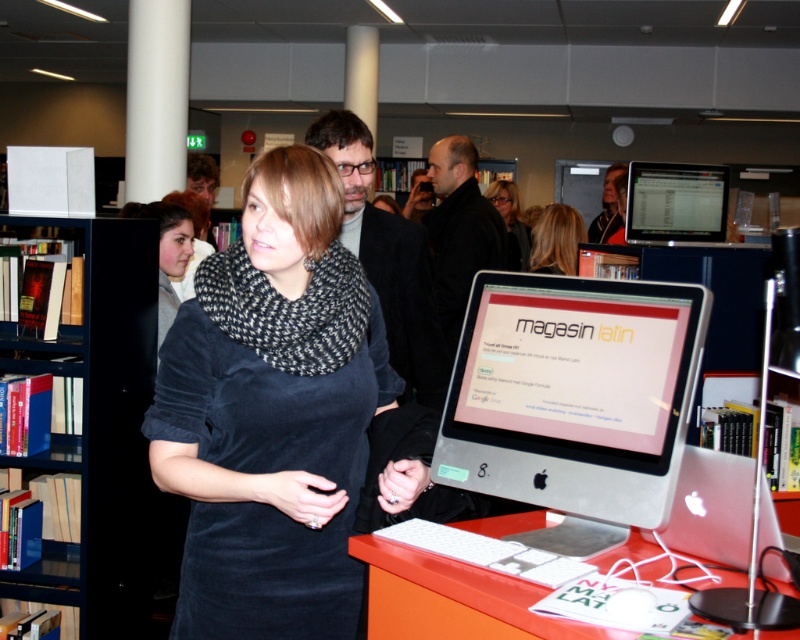
Does gray knit scarf at center appear under black knit scarf at center?

Yes, gray knit scarf at center is below black knit scarf at center.

You are a GUI agent. You are given a task and a screenshot of the screen. Output one action in this format:
    pyautogui.click(x=<x>, y=<y>)
    Task: Click on the gray knit scarf at center
    
    Given the screenshot: What is the action you would take?
    pyautogui.click(x=166, y=252)

Identify the location of gray knit scarf at center. The image size is (800, 640). (166, 252).

I want to click on matte black jacket at center, so click(x=388, y=259).

Which is more to the left, matte black jacket at center or matte black scarf at center?

Positioned to the left is matte black jacket at center.

Is point (418, 371) less distant than point (496, 198)?

Yes, it is.

You are a GUI agent. You are given a task and a screenshot of the screen. Output one action in this format:
    pyautogui.click(x=<x>, y=<y>)
    Task: Click on the matte black jacket at center
    
    Given the screenshot: What is the action you would take?
    tap(388, 259)

Does point (432, 294) come in front of point (134, 204)?

That is True.

At what (x,y) coordinates should I click in order to perform the action: click on matte black jacket at center. Please return your answer as a coordinate pair (x, y). Looking at the image, I should click on (388, 259).

Image resolution: width=800 pixels, height=640 pixels. I want to click on matte black jacket at center, so click(388, 259).